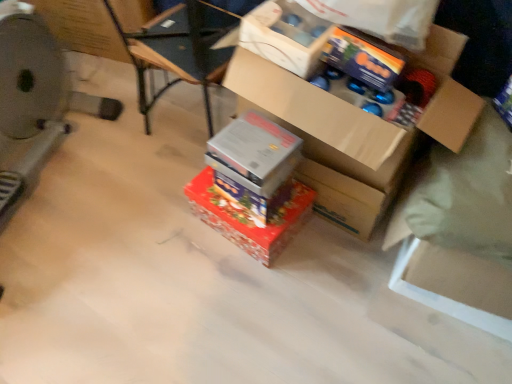
Question: Can you confirm if cardboard box at upper center is thinner than metallic silver exercise machine at left?

Choices:
 (A) yes
 (B) no

Answer: (A)

Question: Is cardboard box at upper center surrounding metallic silver exercise machine at left?

Choices:
 (A) yes
 (B) no

Answer: (B)

Question: Is cardboard box at upper center looking in the opposite direction of metallic silver exercise machine at left?

Choices:
 (A) no
 (B) yes

Answer: (A)

Question: From the image's perspective, is cardboard box at upper center above metallic silver exercise machine at left?

Choices:
 (A) no
 (B) yes

Answer: (B)

Question: Considering the relative positions of cardboard box at upper center and metallic silver exercise machine at left in the image provided, is cardboard box at upper center to the left of metallic silver exercise machine at left from the viewer's perspective?

Choices:
 (A) yes
 (B) no

Answer: (B)

Question: Is cardboard box at upper center closer to the viewer compared to metallic silver exercise machine at left?

Choices:
 (A) no
 (B) yes

Answer: (A)

Question: Is metallic silver box at center, the second box positioned from the top, behind cardboard box at center, positioned as the third box in bottom-to-top order?

Choices:
 (A) yes
 (B) no

Answer: (A)

Question: From the image's perspective, does metallic silver box at center, which appears as the second box when ordered from the bottom, appear lower than cardboard box at center, positioned as the third box in bottom-to-top order?

Choices:
 (A) yes
 (B) no

Answer: (A)

Question: From a real-world perspective, is metallic silver box at center, the second box positioned from the top, on cardboard box at center, positioned as the third box in bottom-to-top order?

Choices:
 (A) no
 (B) yes

Answer: (A)

Question: Can you confirm if metallic silver box at center, the second box positioned from the top, is shorter than cardboard box at center, positioned as the third box in bottom-to-top order?

Choices:
 (A) no
 (B) yes

Answer: (B)

Question: Considering the relative sizes of metallic silver box at center, the second box positioned from the top, and cardboard box at center, which appears as the 1th box when viewed from the top, in the image provided, is metallic silver box at center, the second box positioned from the top, smaller than cardboard box at center, which appears as the 1th box when viewed from the top,?

Choices:
 (A) yes
 (B) no

Answer: (A)

Question: Considering the relative positions of metallic silver box at center, which appears as the second box when ordered from the bottom, and cardboard box at center, positioned as the third box in bottom-to-top order, in the image provided, is metallic silver box at center, which appears as the second box when ordered from the bottom, in front of cardboard box at center, positioned as the third box in bottom-to-top order,?

Choices:
 (A) no
 (B) yes

Answer: (A)

Question: From a real-world perspective, does metallic silver exercise machine at left stand above shiny metallic box at center, positioned as the 3th box in top-to-bottom order?

Choices:
 (A) yes
 (B) no

Answer: (A)